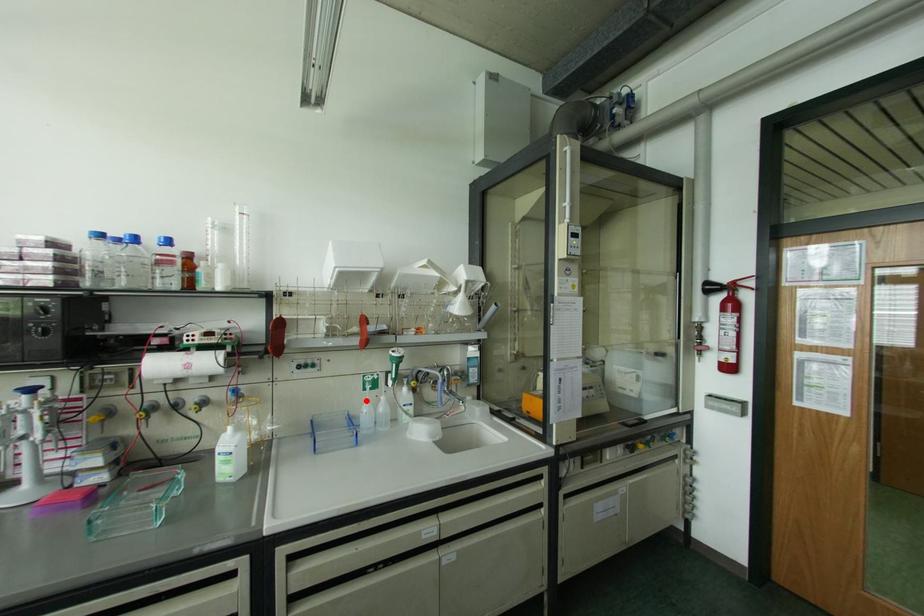
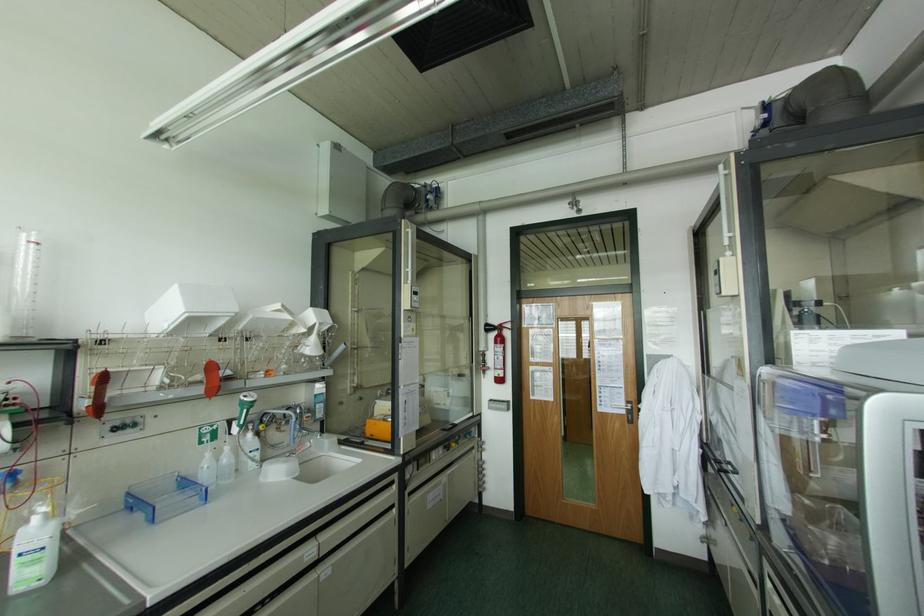
Locate, in the second image, the point that corresponds to the highlighted location in the first image.

(208, 454)